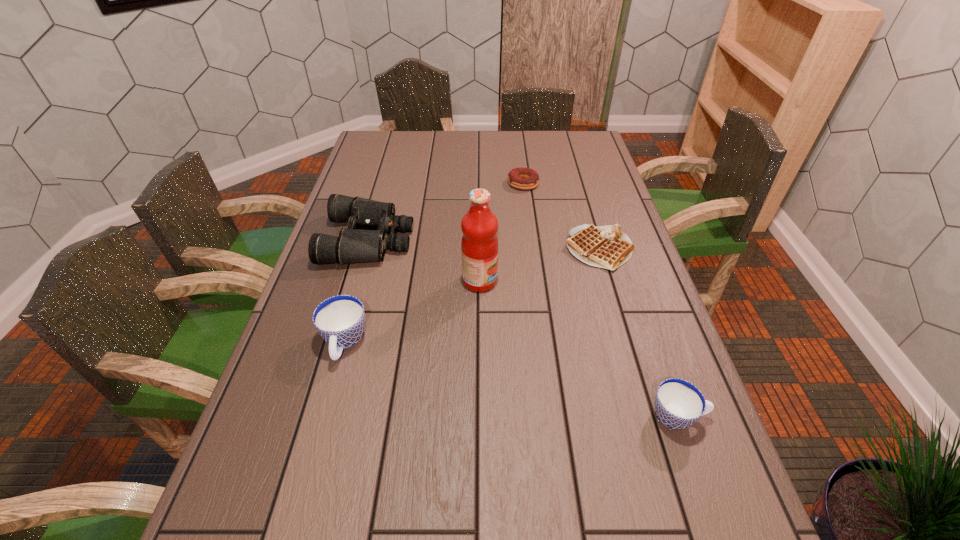
I want to click on unoccupied position between the third object from left to right and the binoculars, so click(x=424, y=260).

Image resolution: width=960 pixels, height=540 pixels. Find the location of `free area in between the farther cup and the binoculars`. free area in between the farther cup and the binoculars is located at coordinates (357, 292).

Identify which object is the third closest to the binoculars. Please provide its 2D coordinates. Your answer should be formatted as a tuple, i.e. [(x, y)], where the tuple contains the x and y coordinates of a point satisfying the conditions above.

[(522, 178)]

Select which object is the closest to the shorter cup. Please provide its 2D coordinates. Your answer should be formatted as a tuple, i.e. [(x, y)], where the tuple contains the x and y coordinates of a point satisfying the conditions above.

[(608, 247)]

Where is `vacant space that satisfies the following two spatial constraints: 1. on the back side of the waffle; 2. through the eyepieces of the binoculars`? vacant space that satisfies the following two spatial constraints: 1. on the back side of the waffle; 2. through the eyepieces of the binoculars is located at coordinates (596, 240).